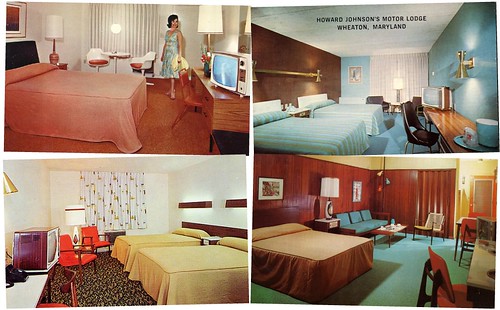
Identify the location of pictures. Image resolution: width=500 pixels, height=310 pixels. (18, 17), (358, 74), (358, 188), (273, 191).